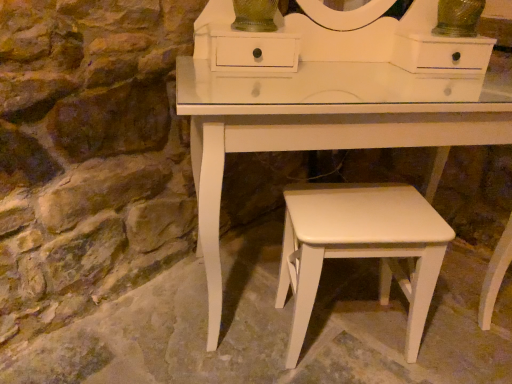
In order to click on vacant space that is to the left of white matte stool at center in this screenshot , I will do `click(247, 332)`.